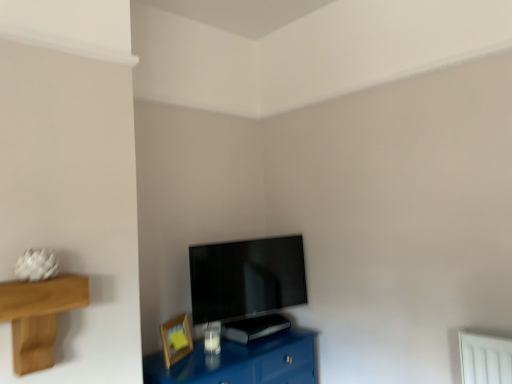
Question: Considering the relative sizes of flat screen tv at center and glossy blue table at lower center in the image provided, is flat screen tv at center taller than glossy blue table at lower center?

Choices:
 (A) no
 (B) yes

Answer: (B)

Question: Considering the relative sizes of flat screen tv at center and glossy blue table at lower center in the image provided, is flat screen tv at center smaller than glossy blue table at lower center?

Choices:
 (A) yes
 (B) no

Answer: (A)

Question: Is flat screen tv at center to the left of glossy blue table at lower center from the viewer's perspective?

Choices:
 (A) no
 (B) yes

Answer: (A)

Question: From a real-world perspective, does flat screen tv at center stand above glossy blue table at lower center?

Choices:
 (A) yes
 (B) no

Answer: (A)

Question: Is flat screen tv at center shorter than glossy blue table at lower center?

Choices:
 (A) yes
 (B) no

Answer: (B)

Question: Is glossy blue table at lower center to the left or to the right of flat screen tv at center in the image?

Choices:
 (A) left
 (B) right

Answer: (A)

Question: Relative to flat screen tv at center, is glossy blue table at lower center in front or behind?

Choices:
 (A) front
 (B) behind

Answer: (A)

Question: Which is correct: glossy blue table at lower center is inside flat screen tv at center, or outside of it?

Choices:
 (A) outside
 (B) inside

Answer: (A)

Question: From the image's perspective, is glossy blue table at lower center positioned above or below flat screen tv at center?

Choices:
 (A) above
 (B) below

Answer: (B)

Question: From the image's perspective, relative to flat screen tv at center, is wooden picture frame at lower left above or below?

Choices:
 (A) above
 (B) below

Answer: (B)

Question: Considering their positions, is wooden picture frame at lower left located in front of or behind flat screen tv at center?

Choices:
 (A) behind
 (B) front

Answer: (B)

Question: Is wooden picture frame at lower left wider or thinner than flat screen tv at center?

Choices:
 (A) wide
 (B) thin

Answer: (B)

Question: Considering the positions of wooden picture frame at lower left and flat screen tv at center in the image, is wooden picture frame at lower left taller or shorter than flat screen tv at center?

Choices:
 (A) short
 (B) tall

Answer: (A)

Question: From a real-world perspective, is wooden picture frame at lower left positioned above or below glossy blue table at lower center?

Choices:
 (A) below
 (B) above

Answer: (B)

Question: In terms of width, does wooden picture frame at lower left look wider or thinner when compared to glossy blue table at lower center?

Choices:
 (A) thin
 (B) wide

Answer: (A)